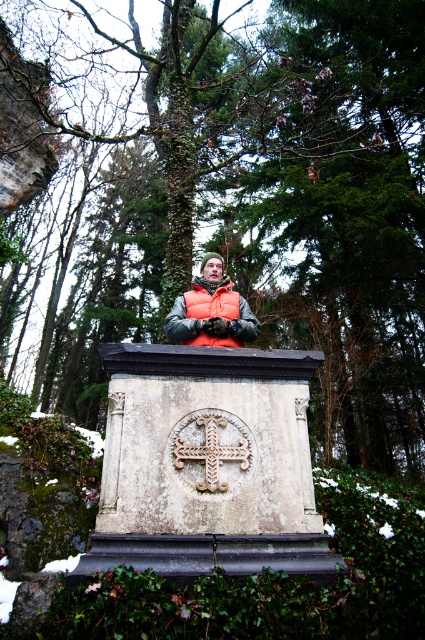
You are a park ranger checking the monuments in the forest. You notice the white stone monument at center and the rusty metal cross at center. Which one has a greater width?

The white stone monument at center has a greater width than the rusty metal cross at center.

You are a hiker who has reached the white stone monument at center and the rusty metal cross at center. Which object is positioned more to the left?

The white stone monument at center is positioned more to the left than the rusty metal cross at center.